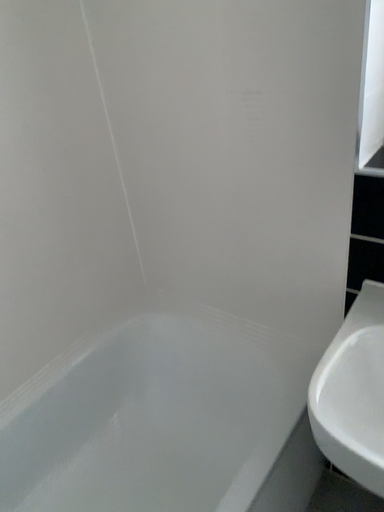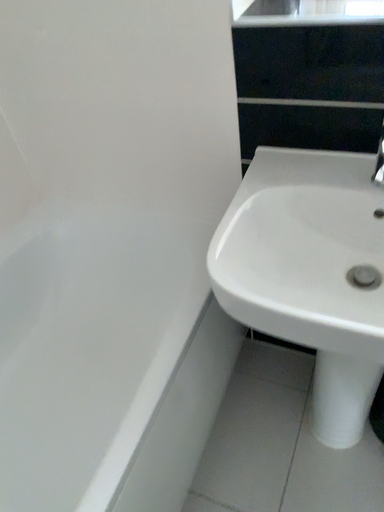
Question: Which way did the camera rotate in the video?

Choices:
 (A) rotated upward
 (B) rotated downward

Answer: (B)